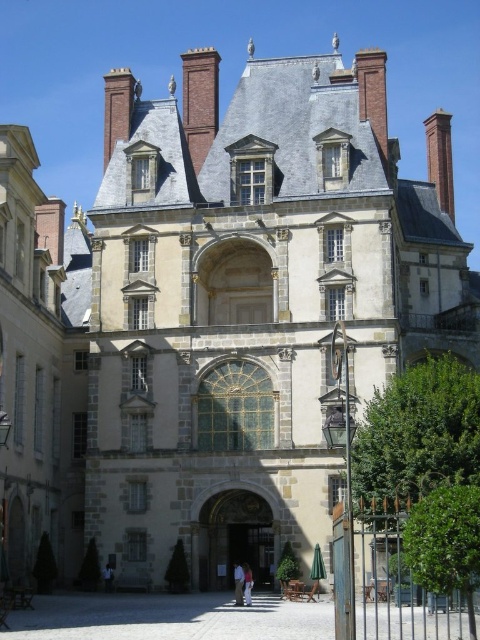
Question: Is light brown leather jacket at center positioned at the back of white cotton shirt at center?

Choices:
 (A) no
 (B) yes

Answer: (A)

Question: Which object is the farthest from the brown wooden door at center?

Choices:
 (A) white cotton shirt at center
 (B) smooth stone mansion at center
 (C) light brown leather jacket at center

Answer: (B)

Question: Does light brown leather jacket at center have a larger size compared to white cotton shirt at center?

Choices:
 (A) yes
 (B) no

Answer: (A)

Question: Which point is farther to the camera?

Choices:
 (A) white cotton shirt at center
 (B) smooth stone mansion at center

Answer: (B)

Question: Estimate the real-world distances between objects in this image. Which object is farther from the brown wooden door at center?

Choices:
 (A) white cotton shirt at center
 (B) light brown leather jacket at center
 (C) smooth stone mansion at center

Answer: (C)

Question: Is brown wooden door at center closer to camera compared to light brown leather jacket at center?

Choices:
 (A) no
 (B) yes

Answer: (A)